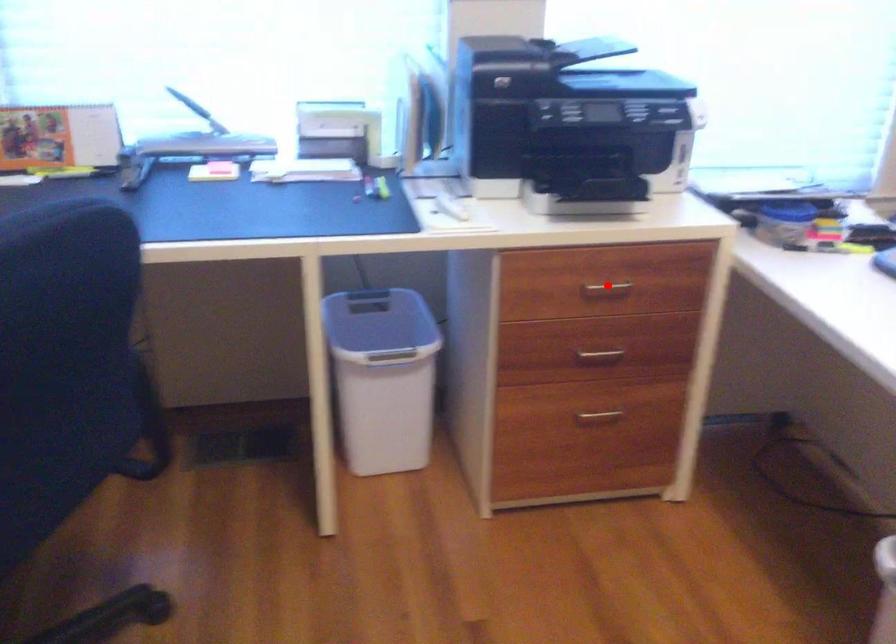
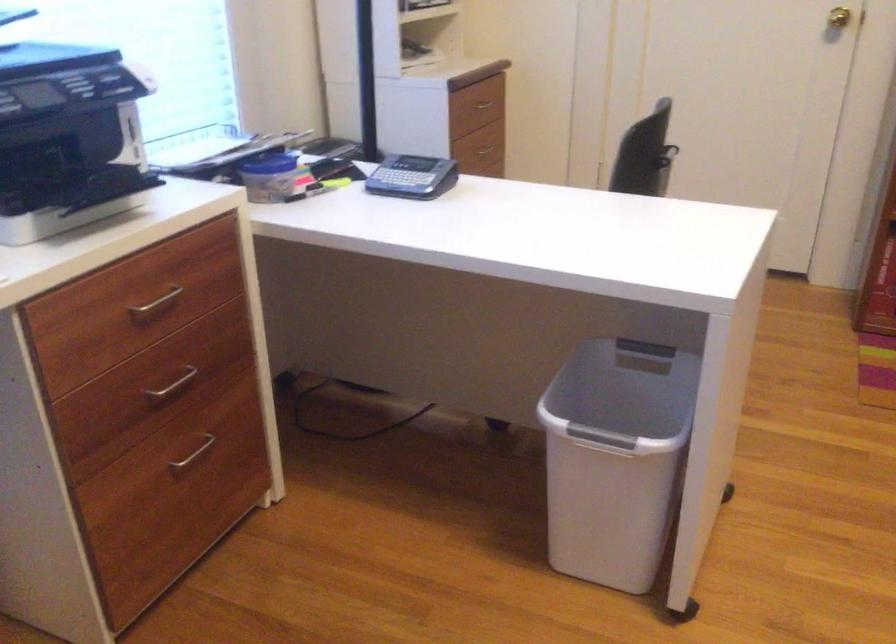
Question: I am providing you with two images of the same scene from different viewpoints. A red point is shown in image1. For the corresponding object point in image2, is it positioned nearer or farther from the camera?

Choices:
 (A) Nearer
 (B) Farther

Answer: (A)